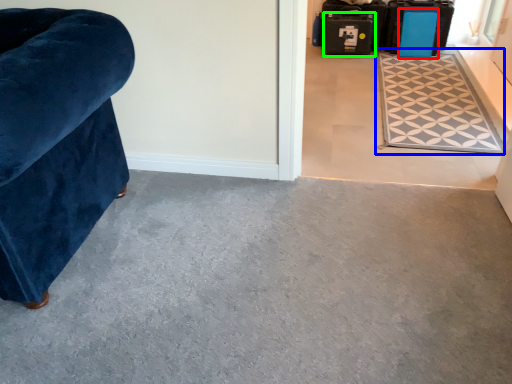
Question: Which object is positioned farthest from luggage (highlighted by a red box)? Select from mat (highlighted by a blue box) and luggage (highlighted by a green box).

Choices:
 (A) mat
 (B) luggage

Answer: (A)